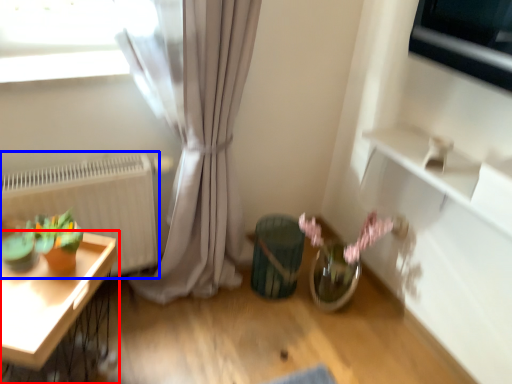
Question: Among these objects, which one is farthest to the camera, table (highlighted by a red box) or radiator (highlighted by a blue box)?

Choices:
 (A) table
 (B) radiator

Answer: (B)